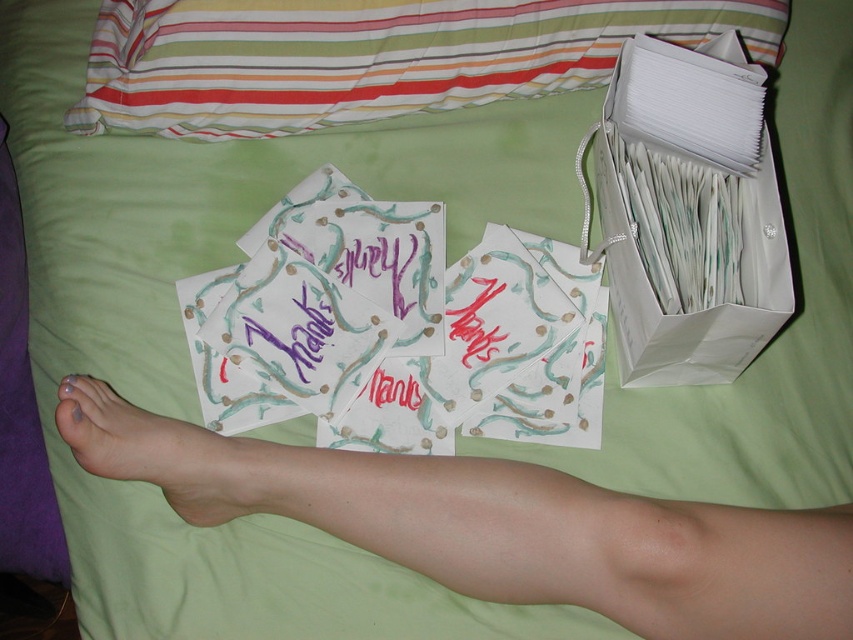
Question: Among these points, which one is nearest to the camera?

Choices:
 (A) (781, 630)
 (B) (100, 474)

Answer: (A)

Question: Which of the following is the farthest from the observer?

Choices:
 (A) nude skin at lower center
 (B) white paper bag at upper right
 (C) green fabric pillow at upper center
 (D) pale skin leg at lower center

Answer: (C)

Question: Where is pale skin leg at lower center located in relation to nude skin at lower center in the image?

Choices:
 (A) below
 (B) above

Answer: (A)

Question: Which point is farther from the camera taking this photo?

Choices:
 (A) (320, 96)
 (B) (776, 298)
 (C) (486, 476)

Answer: (A)

Question: Is pale skin leg at lower center closer to camera compared to green fabric pillow at upper center?

Choices:
 (A) yes
 (B) no

Answer: (A)

Question: From the image, what is the correct spatial relationship of green fabric pillow at upper center in relation to white paper bag at upper right?

Choices:
 (A) above
 (B) below

Answer: (A)